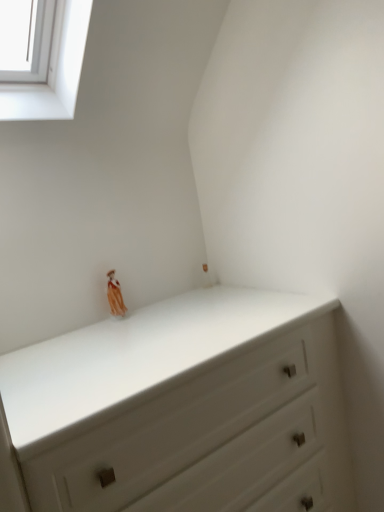
Question: Considering the relative sizes of matte orange figurine at upper center and white glass window at upper left in the image provided, is matte orange figurine at upper center wider than white glass window at upper left?

Choices:
 (A) yes
 (B) no

Answer: (B)

Question: Is white glass window at upper left a part of matte orange figurine at upper center?

Choices:
 (A) yes
 (B) no

Answer: (B)

Question: Does matte orange figurine at upper center lie in front of white glass window at upper left?

Choices:
 (A) no
 (B) yes

Answer: (A)

Question: From the image's perspective, is matte orange figurine at upper center located beneath white glass window at upper left?

Choices:
 (A) yes
 (B) no

Answer: (A)

Question: Does matte orange figurine at upper center have a larger size compared to white glass window at upper left?

Choices:
 (A) no
 (B) yes

Answer: (A)

Question: Can you confirm if matte orange figurine at upper center is taller than white glass window at upper left?

Choices:
 (A) no
 (B) yes

Answer: (A)

Question: Is white glass window at upper left to the right of matte orange figurine at upper center from the viewer's perspective?

Choices:
 (A) yes
 (B) no

Answer: (B)

Question: Is white glass window at upper left located outside matte orange figurine at upper center?

Choices:
 (A) yes
 (B) no

Answer: (A)

Question: Does white glass window at upper left come behind matte orange figurine at upper center?

Choices:
 (A) yes
 (B) no

Answer: (B)

Question: Can you confirm if white glass window at upper left is bigger than matte orange figurine at upper center?

Choices:
 (A) yes
 (B) no

Answer: (A)

Question: From a real-world perspective, is white glass window at upper left physically above matte orange figurine at upper center?

Choices:
 (A) yes
 (B) no

Answer: (A)

Question: From a real-world perspective, is white glass window at upper left below matte orange figurine at upper center?

Choices:
 (A) no
 (B) yes

Answer: (A)

Question: Considering the relative sizes of matte orange figurine at upper center and white matte chest of drawers at center in the image provided, is matte orange figurine at upper center thinner than white matte chest of drawers at center?

Choices:
 (A) yes
 (B) no

Answer: (A)